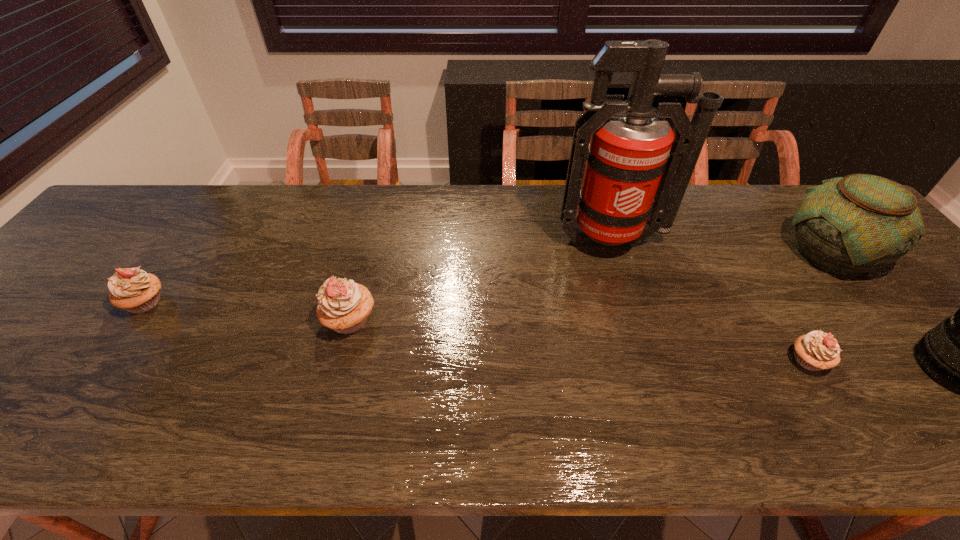
What are the coordinates of `vacant point at the near edge` in the screenshot? It's located at (738, 373).

In order to click on free space at the left edge of the desktop in this screenshot , I will do `click(95, 246)`.

The width and height of the screenshot is (960, 540). In order to click on free space between the fire extinguisher and the fourth tallest object in this screenshot , I will do `click(481, 281)`.

Locate an element on the screen. This screenshot has width=960, height=540. free spot between the nearest cupcake and the second shortest object is located at coordinates (477, 332).

Where is `free point between the pottery and the second shortest cupcake`? The height and width of the screenshot is (540, 960). free point between the pottery and the second shortest cupcake is located at coordinates (489, 278).

Find the location of a particular element. Image resolution: width=960 pixels, height=540 pixels. empty space between the second object from left to right and the fifth tallest object is located at coordinates (248, 312).

Locate an element on the screen. free space that is in between the fifth object from right to left and the fifth tallest object is located at coordinates (248, 312).

Locate an element on the screen. Image resolution: width=960 pixels, height=540 pixels. free space between the shortest object and the fifth tallest object is located at coordinates (477, 332).

Locate an element on the screen. The height and width of the screenshot is (540, 960). vacant space in between the shortest object and the leftmost object is located at coordinates (477, 332).

I want to click on free space between the leftmost object and the pottery, so click(489, 278).